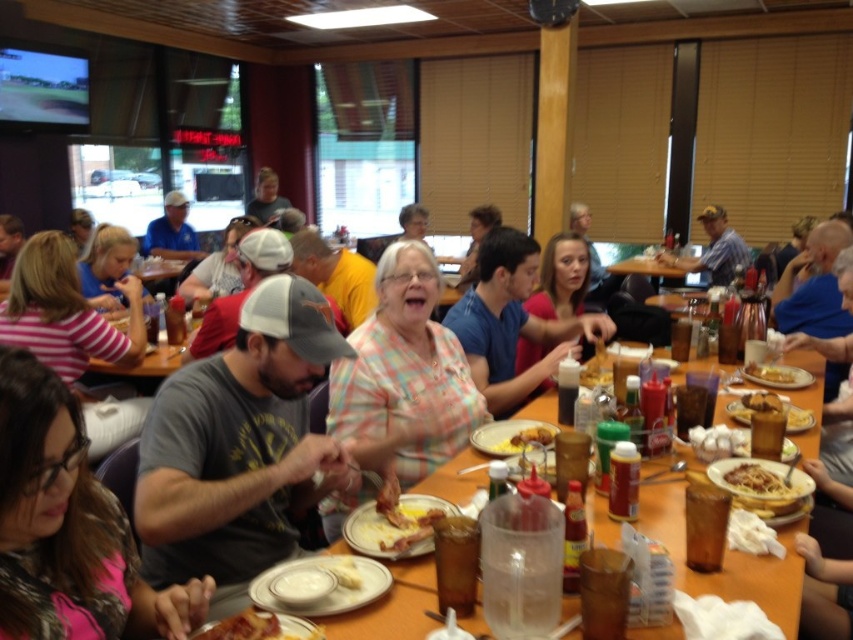
What do you see at coordinates (320, 584) in the screenshot? I see `white matte plate at center` at bounding box center [320, 584].

Does point (322, 600) come behind point (503, 452)?

No.

Is point (379, 595) closer to viewer compared to point (544, 429)?

Yes, point (379, 595) is closer to viewer.

Image resolution: width=853 pixels, height=640 pixels. Identify the location of white matte plate at center. (320, 584).

Can you confirm if white matte plate at center is positioned to the right of golden crispy bacon at center?

Indeed, white matte plate at center is positioned on the right side of golden crispy bacon at center.

Where is `white matte plate at center`? white matte plate at center is located at coordinates (320, 584).

Where is `white matte plate at center`? white matte plate at center is located at coordinates (320, 584).

Does golden crispy chicken at center appear under golden crispy fries at center?

Correct, golden crispy chicken at center is located below golden crispy fries at center.

Who is taller, golden crispy chicken at center or golden crispy fries at center?

golden crispy chicken at center is taller.

Where is `golden crispy chicken at center`? golden crispy chicken at center is located at coordinates (798, 419).